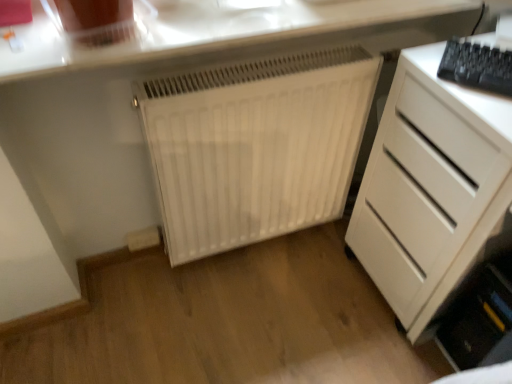
Question: Should I look upward or downward to see white matte chest of drawers at right?

Choices:
 (A) down
 (B) up

Answer: (A)

Question: Would you consider black plastic keyboard at upper right to be distant from white matte chest of drawers at right?

Choices:
 (A) no
 (B) yes

Answer: (A)

Question: From a real-world perspective, is black plastic keyboard at upper right positioned under white matte chest of drawers at right based on gravity?

Choices:
 (A) yes
 (B) no

Answer: (B)

Question: Is white matte chest of drawers at right located within black plastic keyboard at upper right?

Choices:
 (A) no
 (B) yes

Answer: (A)

Question: From the image's perspective, is black plastic keyboard at upper right beneath white matte chest of drawers at right?

Choices:
 (A) yes
 (B) no

Answer: (B)

Question: Could you tell me if black plastic keyboard at upper right is facing white matte chest of drawers at right?

Choices:
 (A) no
 (B) yes

Answer: (A)

Question: Can you confirm if black plastic keyboard at upper right is taller than white matte chest of drawers at right?

Choices:
 (A) no
 (B) yes

Answer: (A)

Question: Does white matte chest of drawers at right have a greater height compared to white glossy countertop at upper center?

Choices:
 (A) yes
 (B) no

Answer: (A)

Question: Does white matte chest of drawers at right have a greater width compared to white glossy countertop at upper center?

Choices:
 (A) no
 (B) yes

Answer: (B)

Question: Considering the relative positions of white matte chest of drawers at right and white glossy countertop at upper center in the image provided, is white matte chest of drawers at right to the left of white glossy countertop at upper center from the viewer's perspective?

Choices:
 (A) yes
 (B) no

Answer: (B)

Question: Is white glossy countertop at upper center a part of white matte chest of drawers at right?

Choices:
 (A) no
 (B) yes

Answer: (A)

Question: Is white matte chest of drawers at right positioned before white glossy countertop at upper center?

Choices:
 (A) no
 (B) yes

Answer: (B)

Question: Would you say white matte chest of drawers at right is outside white glossy countertop at upper center?

Choices:
 (A) no
 (B) yes

Answer: (B)

Question: Is white matte radiator at center next to white matte chest of drawers at right and touching it?

Choices:
 (A) yes
 (B) no

Answer: (B)